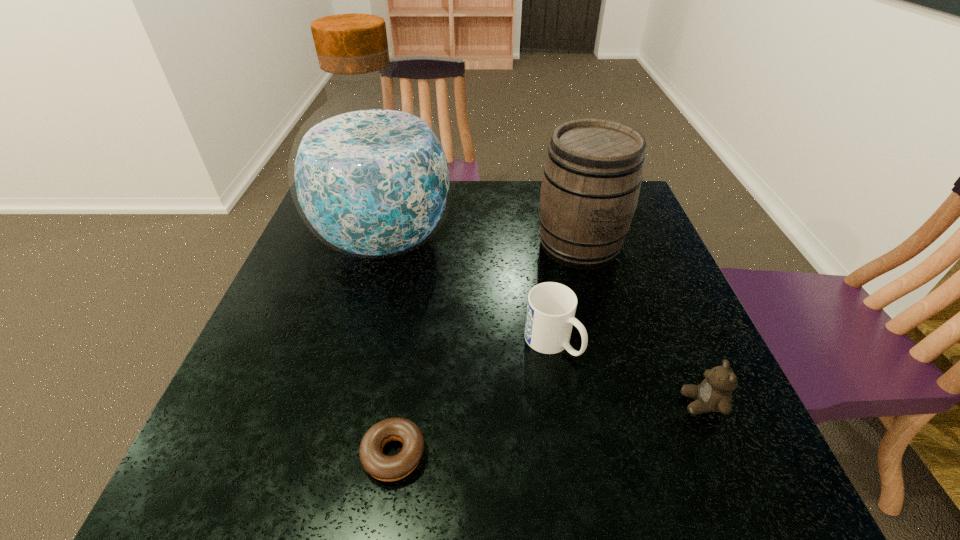
The width and height of the screenshot is (960, 540). In the image, there is a desktop. Find the location of `free region at the near edge`. free region at the near edge is located at coordinates (542, 495).

You are a GUI agent. You are given a task and a screenshot of the screen. Output one action in this format:
    pyautogui.click(x=<x>, y=<y>)
    Task: Click on the free spot at the left edge of the desktop
    This screenshot has height=540, width=960.
    Given the screenshot: What is the action you would take?
    pyautogui.click(x=286, y=442)

This screenshot has width=960, height=540. What are the coordinates of `free space at the right edge` in the screenshot? It's located at (685, 305).

The width and height of the screenshot is (960, 540). What are the coordinates of `vacant space at the near right corner of the desktop` in the screenshot? It's located at (764, 480).

You are a GUI agent. You are given a task and a screenshot of the screen. Output one action in this format:
    pyautogui.click(x=<x>, y=<y>)
    Task: Click on the free point between the shortest object and the teddy bear
    The image size is (960, 540).
    Given the screenshot: What is the action you would take?
    pyautogui.click(x=548, y=429)

The height and width of the screenshot is (540, 960). In order to click on free point between the water jug and the second tallest object in this screenshot , I will do `click(482, 242)`.

The width and height of the screenshot is (960, 540). I want to click on vacant area that lies between the shortest object and the teddy bear, so click(548, 429).

Find the location of a particular element. The image size is (960, 540). free space between the tallest object and the doughnut is located at coordinates (390, 347).

The width and height of the screenshot is (960, 540). Identify the location of free space between the teddy bear and the wine bucket. (640, 324).

What are the coordinates of `free area in between the fourth shortest object and the shortest object` in the screenshot? It's located at (x=487, y=349).